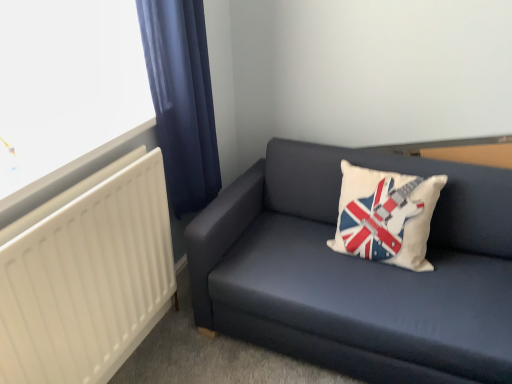
What is the approximate height of dark blue fabric couch at lower right?

dark blue fabric couch at lower right is 27.14 inches in height.

What do you see at coordinates (87, 279) in the screenshot? The width and height of the screenshot is (512, 384). I see `white matte radiator at left` at bounding box center [87, 279].

The image size is (512, 384). Find the location of `dark blue fabric curtain at left`. dark blue fabric curtain at left is located at coordinates (182, 99).

Where is `pillow located above the dark blue fabric couch at lower right (from a real-world perspective)`? The width and height of the screenshot is (512, 384). pillow located above the dark blue fabric couch at lower right (from a real-world perspective) is located at coordinates (386, 216).

How far apart are white fabric pillow with union jack design at center and dark blue fabric couch at lower right?

white fabric pillow with union jack design at center is 8.39 inches from dark blue fabric couch at lower right.

Is dark blue fabric couch at lower right located within white fabric pillow with union jack design at center?

No, dark blue fabric couch at lower right is not a part of white fabric pillow with union jack design at center.

Could you tell me if white fabric pillow with union jack design at center is turned towards dark blue fabric couch at lower right?

Yes.

This screenshot has width=512, height=384. What are the coordinates of `curtain behind the white matte radiator at left` in the screenshot? It's located at (182, 99).

Which object is positioned more to the right, dark blue fabric curtain at left or white matte radiator at left?

dark blue fabric curtain at left.

How many degrees apart are the facing directions of dark blue fabric curtain at left and white matte radiator at left?

The angle between the facing direction of dark blue fabric curtain at left and the facing direction of white matte radiator at left is 2.19 degrees.

Choose the correct answer: Is dark blue fabric couch at lower right inside white fabric pillow with union jack design at center or outside it?

dark blue fabric couch at lower right is not inside white fabric pillow with union jack design at center, it's outside.

Does dark blue fabric couch at lower right have a smaller size compared to white fabric pillow with union jack design at center?

No, dark blue fabric couch at lower right is not smaller than white fabric pillow with union jack design at center.

Is dark blue fabric couch at lower right aimed at white fabric pillow with union jack design at center?

Yes.

The image size is (512, 384). I want to click on studio couch to the left of white fabric pillow with union jack design at center, so click(358, 271).

Is dark blue fabric couch at lower right beside dark blue fabric curtain at left?

No, dark blue fabric couch at lower right is not next to dark blue fabric curtain at left.

Is dark blue fabric couch at lower right bigger or smaller than dark blue fabric curtain at left?

In the image, dark blue fabric couch at lower right appears to be larger than dark blue fabric curtain at left.

Is dark blue fabric curtain at left at the back of dark blue fabric couch at lower right?

No, dark blue fabric couch at lower right is not facing the opposite direction of dark blue fabric curtain at left.

From the image's perspective, relative to dark blue fabric curtain at left, is dark blue fabric couch at lower right above or below?

Clearly, from the image's perspective, dark blue fabric couch at lower right is below dark blue fabric curtain at left.

Does point (182, 82) lie behind point (207, 276)?

No.

From the image's perspective, which is below, dark blue fabric curtain at left or dark blue fabric couch at lower right?

dark blue fabric couch at lower right.

The width and height of the screenshot is (512, 384). I want to click on studio couch below the dark blue fabric curtain at left (from a real-world perspective), so click(x=358, y=271).

Choose the correct answer: Is white matte radiator at left inside white fabric pillow with union jack design at center or outside it?

white matte radiator at left is not enclosed by white fabric pillow with union jack design at center.

Is white matte radiator at left aimed at white fabric pillow with union jack design at center?

No, white matte radiator at left is not facing towards white fabric pillow with union jack design at center.

Which object is more forward, white matte radiator at left or white fabric pillow with union jack design at center?

white matte radiator at left is in front.

Where is `pillow behind the white matte radiator at left`? This screenshot has width=512, height=384. pillow behind the white matte radiator at left is located at coordinates (386, 216).

Considering the positions of point (400, 212) and point (157, 191), is point (400, 212) closer or farther from the camera than point (157, 191)?

Point (400, 212).

Does white fabric pillow with union jack design at center appear on the left side of white matte radiator at left?

In fact, white fabric pillow with union jack design at center is to the right of white matte radiator at left.

Who is taller, white fabric pillow with union jack design at center or white matte radiator at left?

Standing taller between the two is white matte radiator at left.

This screenshot has width=512, height=384. What are the coordinates of `pillow that is above the dark blue fabric couch at lower right (from the image's perspective)` in the screenshot? It's located at (386, 216).

Locate an element on the screen. The width and height of the screenshot is (512, 384). curtain positioned vertically above the white matte radiator at left (from a real-world perspective) is located at coordinates (182, 99).

Considering their positions, is white matte radiator at left positioned further to dark blue fabric curtain at left than dark blue fabric couch at lower right?

dark blue fabric couch at lower right.

Looking at the image, which one is located further to white matte radiator at left, dark blue fabric curtain at left or dark blue fabric couch at lower right?

The object further to white matte radiator at left is dark blue fabric couch at lower right.

Which object lies nearer to the anchor point white fabric pillow with union jack design at center, dark blue fabric curtain at left or dark blue fabric couch at lower right?

dark blue fabric couch at lower right lies closer to white fabric pillow with union jack design at center than the other object.

When comparing their distances from white fabric pillow with union jack design at center, does dark blue fabric couch at lower right or dark blue fabric curtain at left seem closer?

dark blue fabric couch at lower right is positioned closer to the anchor white fabric pillow with union jack design at center.

Based on their spatial positions, is white fabric pillow with union jack design at center or dark blue fabric curtain at left further from dark blue fabric couch at lower right?

Among the two, dark blue fabric curtain at left is located further to dark blue fabric couch at lower right.

Considering their positions, is white fabric pillow with union jack design at center positioned closer to dark blue fabric couch at lower right than white matte radiator at left?

white fabric pillow with union jack design at center lies closer to dark blue fabric couch at lower right than the other object.

Which object lies further to the anchor point dark blue fabric curtain at left, white fabric pillow with union jack design at center or white matte radiator at left?

Among the two, white fabric pillow with union jack design at center is located further to dark blue fabric curtain at left.

From the image, which object appears to be nearer to dark blue fabric couch at lower right, dark blue fabric curtain at left or white fabric pillow with union jack design at center?

The object closer to dark blue fabric couch at lower right is white fabric pillow with union jack design at center.

Identify the location of curtain located between white matte radiator at left and dark blue fabric couch at lower right in the left-right direction. The width and height of the screenshot is (512, 384). (182, 99).

The image size is (512, 384). I want to click on studio couch between white matte radiator at left and white fabric pillow with union jack design at center, so click(x=358, y=271).

The height and width of the screenshot is (384, 512). I want to click on curtain between white matte radiator at left and white fabric pillow with union jack design at center in the horizontal direction, so coord(182,99).

Identify the location of studio couch located between dark blue fabric curtain at left and white fabric pillow with union jack design at center in the left-right direction. This screenshot has height=384, width=512. (358, 271).